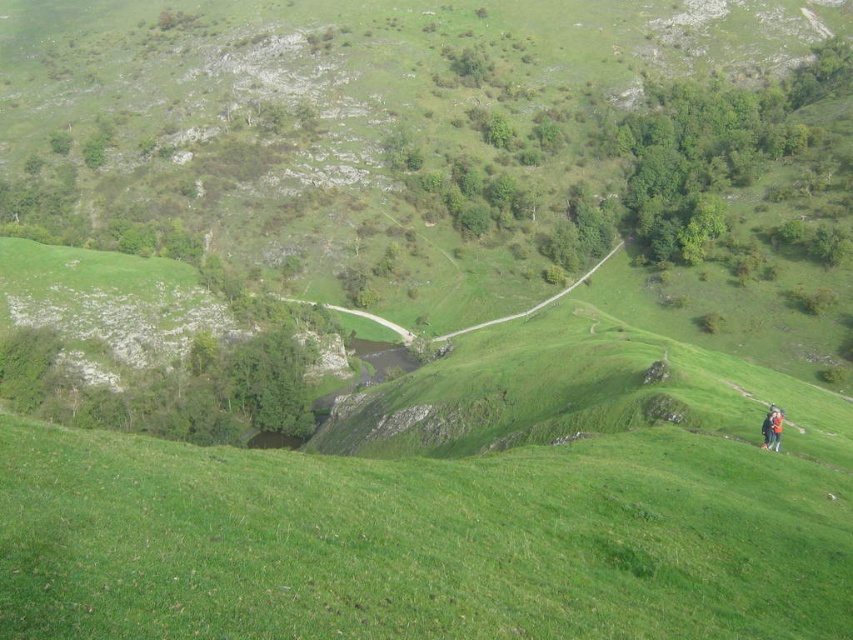
Question: Among these objects, which one is nearest to the camera?

Choices:
 (A) orange fabric jacket at lower right
 (B) green grassy hillside at lower center

Answer: (B)

Question: Does green grassy hillside at lower center appear on the right side of orange fabric jacket at lower right?

Choices:
 (A) no
 (B) yes

Answer: (A)

Question: Is green grassy hillside at lower center thinner than orange fabric jacket at lower right?

Choices:
 (A) no
 (B) yes

Answer: (A)

Question: Does green grassy hillside at lower center have a larger size compared to orange fabric jacket at lower right?

Choices:
 (A) no
 (B) yes

Answer: (B)